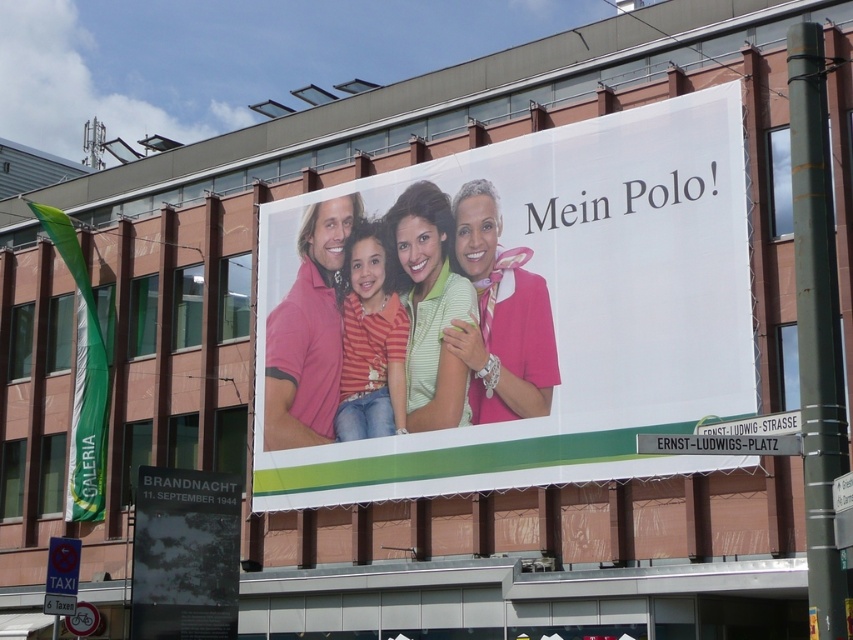
You are standing in front of a large billboard advertisement for a clothing brand. The billboard displays two different pink polo shirts at the center. The first is a matte pink polo shirt at center, and the second is a pink cotton polo shirt at center. You want to know if you can easily distinguish between these two shirts from your current position. Can you tell them apart?

The matte pink polo shirt at center is 26.68 feet away from the pink cotton polo shirt at center. At this distance, it may be challenging to easily distinguish the two shirts unless you have excellent visual acuity or use a device like binoculars.

You are a fashion designer observing the billboard advertisement. You notice two garments displayed at the center of the billboard. Which garment has a greater height measurement between the pink satin blouse at center and the green cotton polo shirt at center?

The pink satin blouse at center is taller than the green cotton polo shirt at center.

You are standing in front of the building with the billboard. The point marked at coordinates (500, 316) is where the pink satin blouse at center is located. If you want to take a photo of the pink satin blouse at center without any obstructions, which direction should you move relative to the billboard?

The point marked at coordinates (500, 316) is where the pink satin blouse at center is located. To take a photo without obstructions, you should move directly towards the billboard to get a clear view of the pink satin blouse at center.